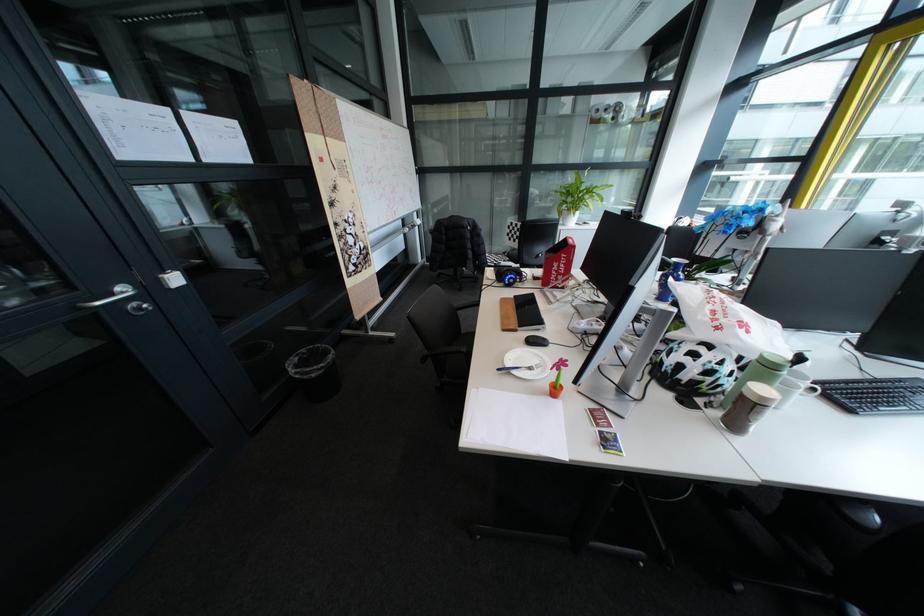
Find where to turn the silver door handle. Please return your answer as a coordinate pair (x, y).

(110, 310)